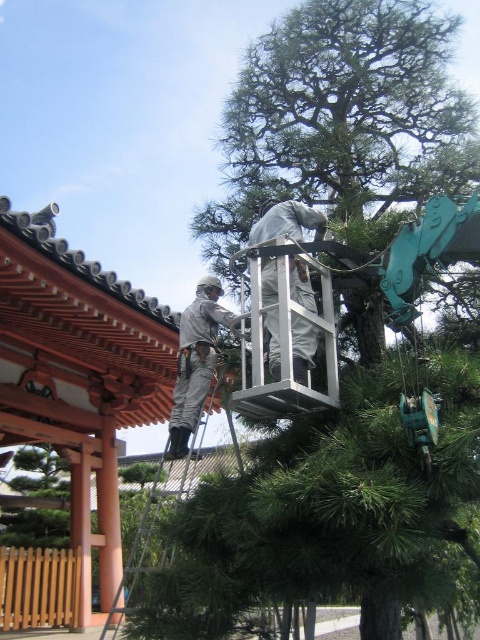
From the picture: Who is positioned more to the left, green textured tree at upper center or gray fabric at center?

Positioned to the left is gray fabric at center.

Measure the distance between green textured tree at upper center and camera.

They are 12.10 meters apart.

What do you see at coordinates (344, 120) in the screenshot? This screenshot has width=480, height=640. I see `green textured tree at upper center` at bounding box center [344, 120].

Find the location of a particular element. green textured tree at upper center is located at coordinates (344, 120).

Between green textured tree at upper center and metallic silver ladder at center, which one appears on the left side from the viewer's perspective?

metallic silver ladder at center is more to the left.

The image size is (480, 640). What do you see at coordinates (344, 120) in the screenshot?
I see `green textured tree at upper center` at bounding box center [344, 120].

Which is behind, point (278, 74) or point (192, 484)?

The point (192, 484) is behind.

Locate an element on the screen. green textured tree at upper center is located at coordinates click(x=344, y=120).

Does gray fabric at center have a greater width compared to gray fabric worker at center?

No, gray fabric at center is not wider than gray fabric worker at center.

From the picture: Is gray fabric at center shorter than gray fabric worker at center?

Correct, gray fabric at center is not as tall as gray fabric worker at center.

Describe the element at coordinates (287, 221) in the screenshot. I see `gray fabric at center` at that location.

Identify the location of gray fabric at center. (287, 221).